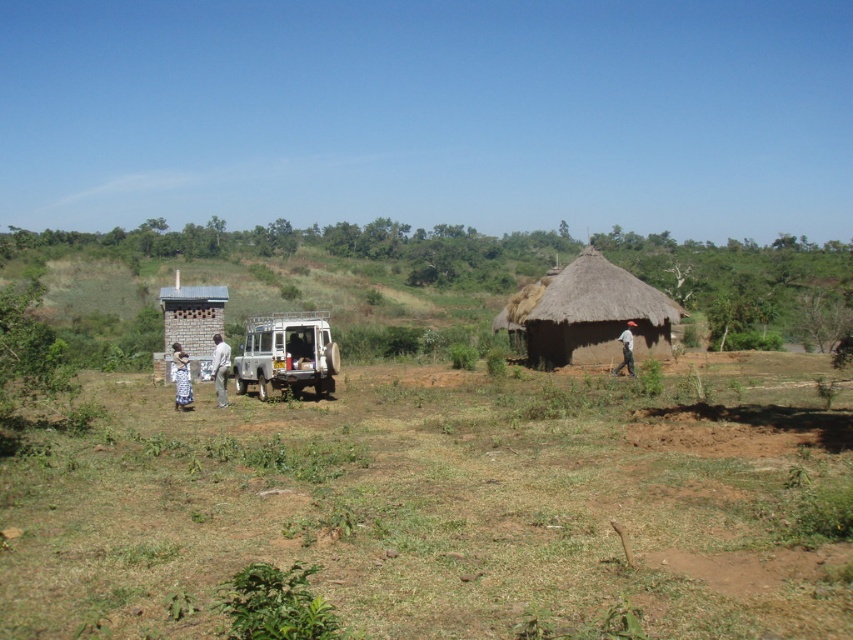
Question: Estimate the real-world distances between objects in this image. Which object is closer to the white lace dress at left?

Choices:
 (A) brown thatch hut at center
 (B) silver metallic jeep at center

Answer: (B)

Question: Is thatched straw hut at right to the left of brown fabric shirt at right from the viewer's perspective?

Choices:
 (A) yes
 (B) no

Answer: (A)

Question: Estimate the real-world distances between objects in this image. Which object is closer to the brown fabric shirt at right?

Choices:
 (A) thatched straw hut at right
 (B) brown thatch hut at center
 (C) white lace dress at left
 (D) silver metallic jeep at center

Answer: (A)

Question: Can you confirm if light brown leather jacket at lower left is bigger than brown fabric shirt at right?

Choices:
 (A) no
 (B) yes

Answer: (A)

Question: Is silver metallic jeep at center bigger than brick wall hut at left?

Choices:
 (A) no
 (B) yes

Answer: (A)

Question: Among these objects, which one is nearest to the camera?

Choices:
 (A) thatched straw hut at right
 (B) brick wall hut at left
 (C) white lace dress at left

Answer: (C)